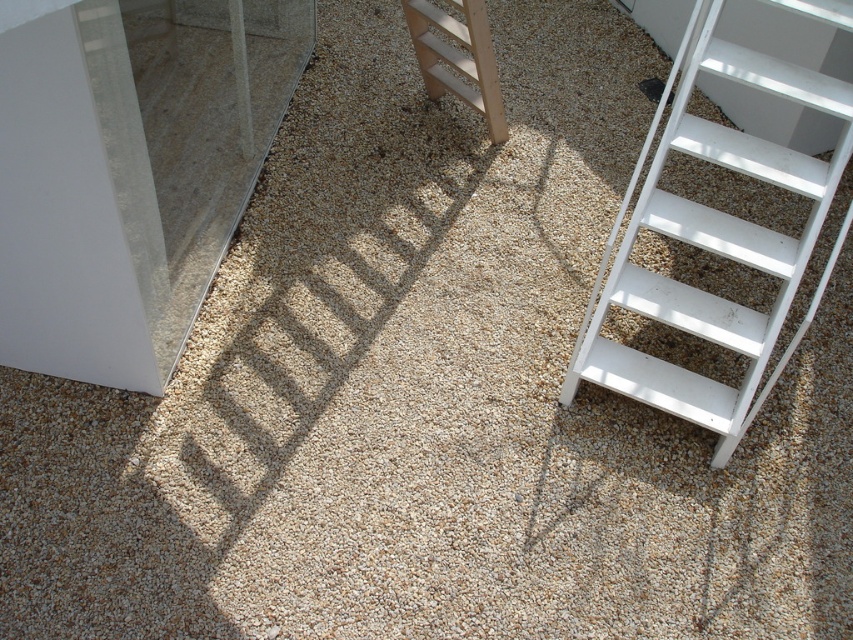
Can you confirm if white matte ladder at lower right is positioned above wooden ladder at center?

No.

Does white matte ladder at lower right have a lesser height compared to wooden ladder at center?

Incorrect, white matte ladder at lower right's height does not fall short of wooden ladder at center's.

Between point (786, 300) and point (440, 22), which one is positioned in front?

Point (786, 300) is more forward.

Locate an element on the screen. white matte ladder at lower right is located at coordinates (714, 241).